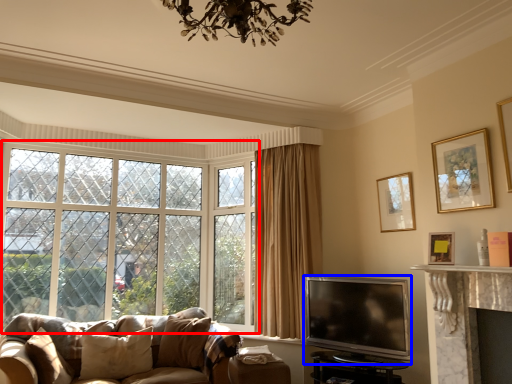
Question: Which point is further to the camera, window (highlighted by a red box) or television (highlighted by a blue box)?

Choices:
 (A) window
 (B) television

Answer: (A)